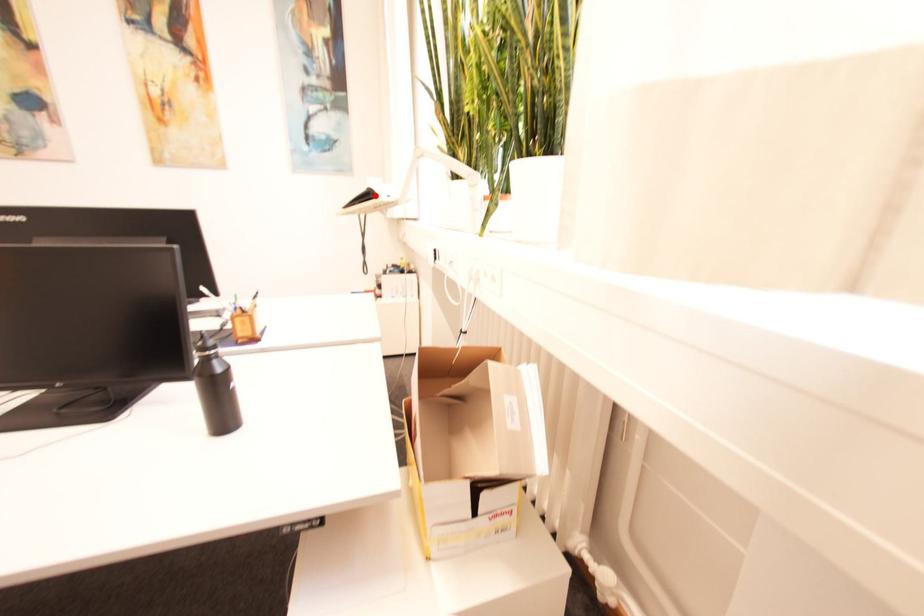
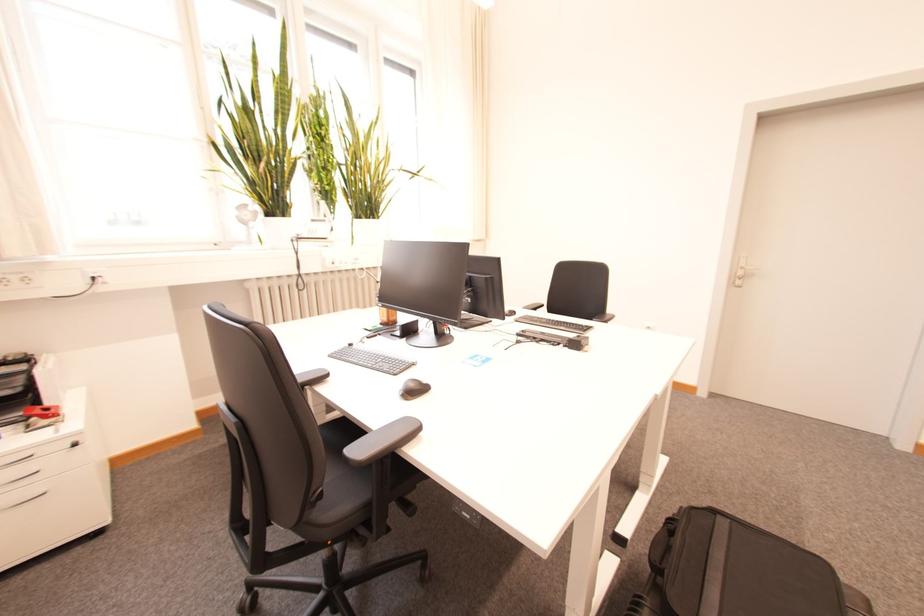
Question: I am providing you with two images of the same scene from different viewpoints. A red point is marked on the first image. Can you still see the location of the red point in image 2?

Choices:
 (A) Yes
 (B) No

Answer: (B)